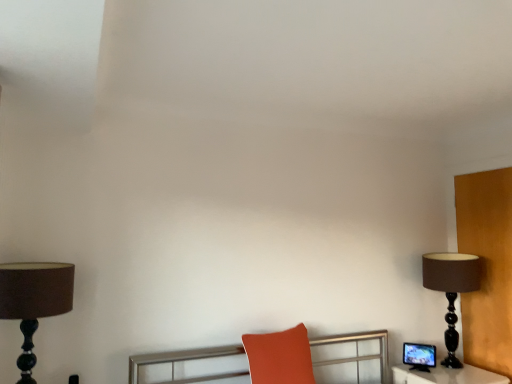
Question: Is matte black monitor at right outside of matte orange cushion at center?

Choices:
 (A) no
 (B) yes

Answer: (B)

Question: Is matte black monitor at right oriented away from matte orange cushion at center?

Choices:
 (A) no
 (B) yes

Answer: (A)

Question: Does matte black monitor at right have a lesser height compared to matte orange cushion at center?

Choices:
 (A) yes
 (B) no

Answer: (A)

Question: Is matte black monitor at right to the left of matte orange cushion at center from the viewer's perspective?

Choices:
 (A) yes
 (B) no

Answer: (B)

Question: Does matte black monitor at right have a smaller size compared to matte orange cushion at center?

Choices:
 (A) yes
 (B) no

Answer: (A)

Question: Considering the relative sizes of matte black monitor at right and matte orange cushion at center in the image provided, is matte black monitor at right taller than matte orange cushion at center?

Choices:
 (A) no
 (B) yes

Answer: (A)

Question: From the image's perspective, is brown matte lamp at right, which appears as the second lamp when viewed from the left, beneath matte black monitor at right?

Choices:
 (A) yes
 (B) no

Answer: (B)

Question: From a real-world perspective, is brown matte lamp at right, placed as the 2th lamp when sorted from front to back, on matte black monitor at right?

Choices:
 (A) yes
 (B) no

Answer: (A)

Question: Can you confirm if brown matte lamp at right, which appears as the second lamp when viewed from the left, is bigger than matte black monitor at right?

Choices:
 (A) yes
 (B) no

Answer: (A)

Question: Could you tell me if brown matte lamp at right, which ranks as the 1th lamp in back-to-front order, is turned towards matte black monitor at right?

Choices:
 (A) no
 (B) yes

Answer: (A)

Question: Is matte black monitor at right at the back of brown matte lamp at right, which ranks as the 1th lamp in back-to-front order?

Choices:
 (A) yes
 (B) no

Answer: (B)

Question: Is brown matte lamp at right, which appears as the second lamp when viewed from the left, behind matte black monitor at right?

Choices:
 (A) yes
 (B) no

Answer: (B)

Question: From a real-world perspective, is brown matte lamp at right, which ranks as the 1th lamp in back-to-front order, located higher than matte orange cushion at center?

Choices:
 (A) no
 (B) yes

Answer: (B)